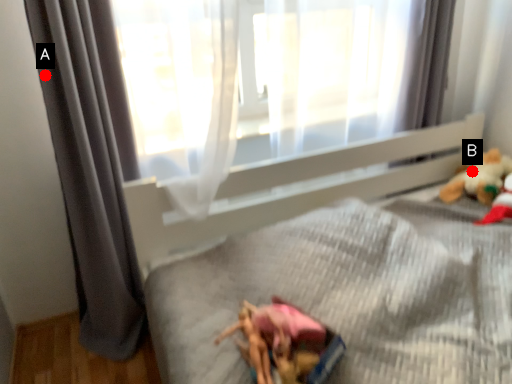
Question: Two points are circled on the image, labeled by A and B beside each circle. Which of the following is the closest to the observer?

Choices:
 (A) A is closer
 (B) B is closer

Answer: (A)